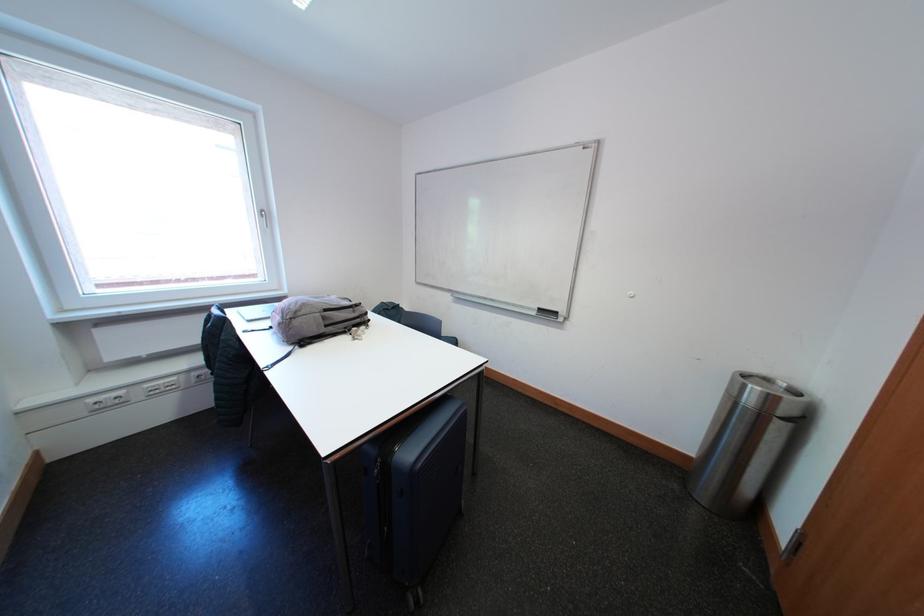
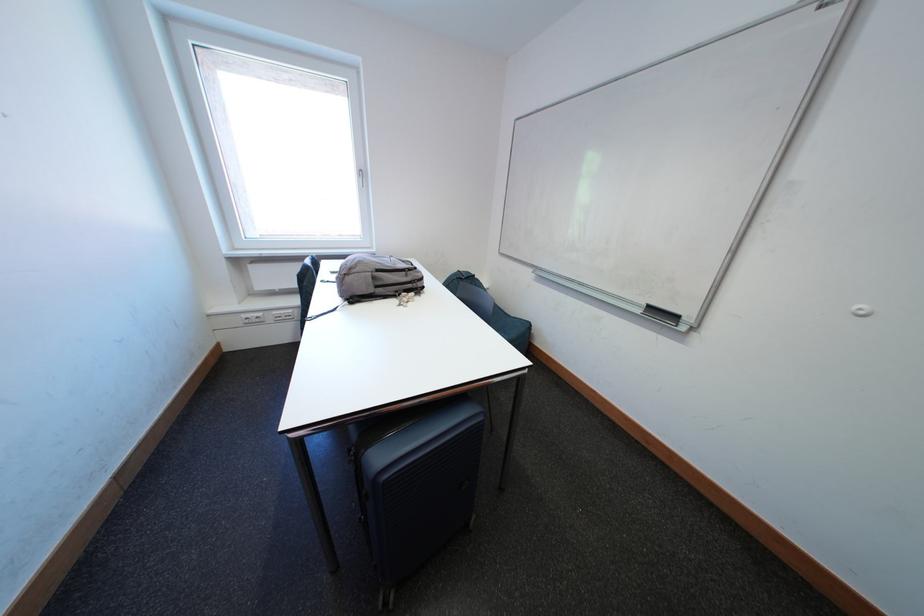
Question: The camera is either moving clockwise (left) or counter-clockwise (right) around the object. The first image is from the beginning of the video and the second image is from the end. Is the camera moving left or right when shooting the video?

Choices:
 (A) Left
 (B) Right

Answer: (B)